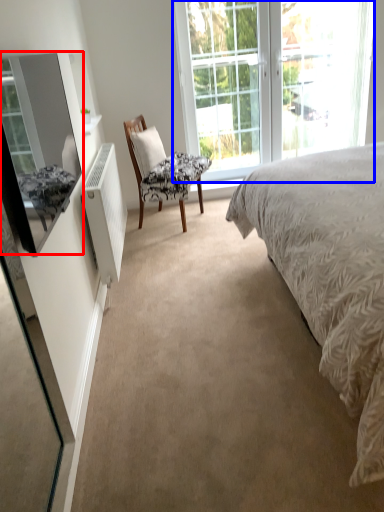
Question: Which object appears closest to the camera in this image, mirror (highlighted by a red box) or window (highlighted by a blue box)?

Choices:
 (A) mirror
 (B) window

Answer: (A)